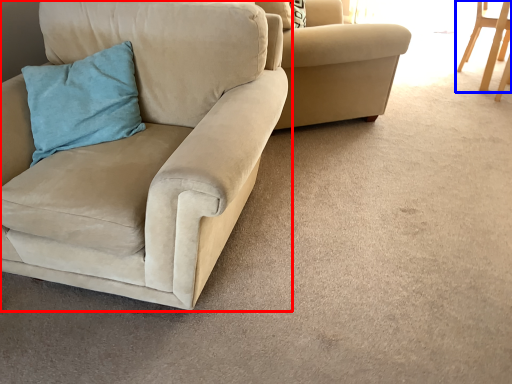
Question: Among these objects, which one is nearest to the camera, chair (highlighted by a red box) or chair (highlighted by a blue box)?

Choices:
 (A) chair
 (B) chair

Answer: (A)